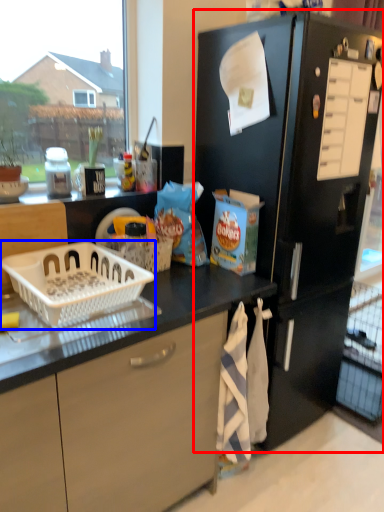
Question: Which object appears closest to the camera in this image, refrigerator (highlighted by a red box) or basket (highlighted by a blue box)?

Choices:
 (A) refrigerator
 (B) basket

Answer: (B)